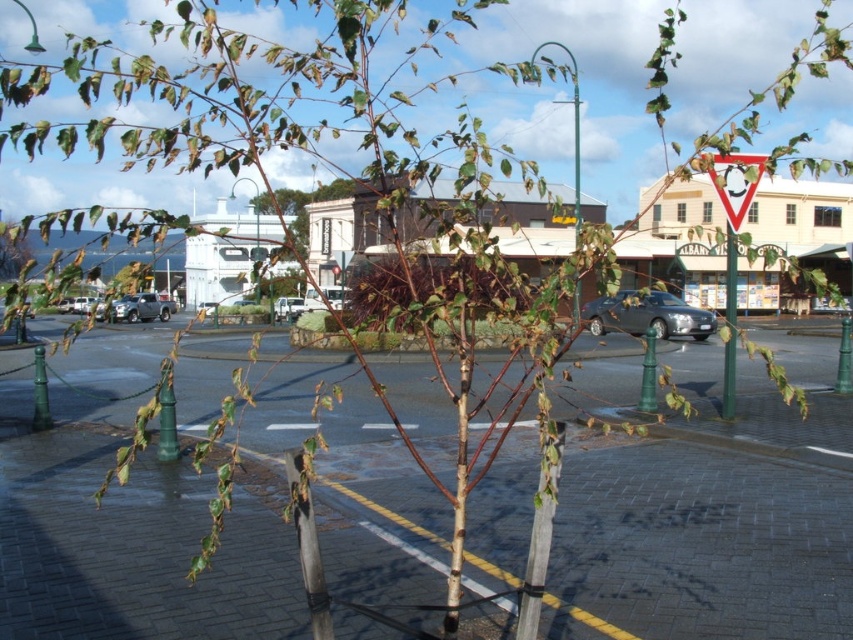
Question: Does satin silver sedan at center appear under green metallic pole at center?

Choices:
 (A) no
 (B) yes

Answer: (B)

Question: Can you confirm if red plastic triangle at upper right is positioned above green metallic pole at center?

Choices:
 (A) no
 (B) yes

Answer: (A)

Question: Can you confirm if satin silver sedan at center is thinner than red plastic triangle at upper right?

Choices:
 (A) no
 (B) yes

Answer: (A)

Question: Among these points, which one is nearest to the camera?

Choices:
 (A) (727, 291)
 (B) (297, 314)
 (C) (747, 205)
 (D) (683, 307)

Answer: (C)

Question: Estimate the real-world distances between objects in this image. Which object is closer to the green matte tree at upper left?

Choices:
 (A) white matte van at center
 (B) green metallic pole at upper center
 (C) satin silver suv at center-left

Answer: (C)

Question: Which object is positioned closest to the red plastic triangle at upper right?

Choices:
 (A) satin silver suv at center-left
 (B) white matte van at center

Answer: (B)